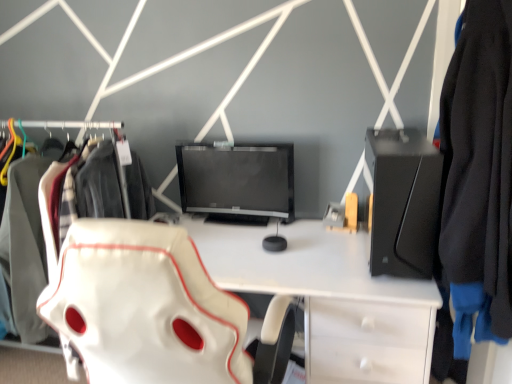
Locate an element on the screen. The height and width of the screenshot is (384, 512). blank space situated above white leather desk at center (from a real-world perspective) is located at coordinates (273, 244).